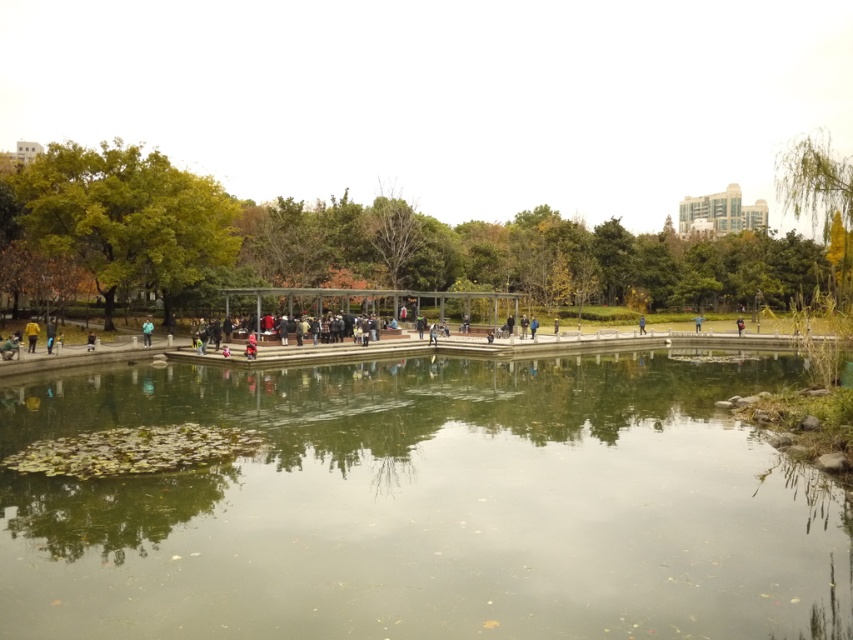
Question: Can you confirm if green reflective water at center is wider than yellow jacket at left?

Choices:
 (A) yes
 (B) no

Answer: (A)

Question: Estimate the real-world distances between objects in this image. Which object is closer to the yellow jacket at left?

Choices:
 (A) green reflective water at center
 (B) green fabric jacket at center

Answer: (B)

Question: Based on their relative distances, which object is farther from the green reflective water at center?

Choices:
 (A) green fabric jacket at center
 (B) yellow jacket at left

Answer: (A)

Question: Can you confirm if yellow jacket at left is positioned below green fabric jacket at center?

Choices:
 (A) yes
 (B) no

Answer: (A)

Question: Which object is closer to the camera taking this photo?

Choices:
 (A) green fabric jacket at center
 (B) yellow jacket at left
 (C) green reflective water at center

Answer: (C)

Question: Is green reflective water at center to the left of green fabric jacket at center from the viewer's perspective?

Choices:
 (A) no
 (B) yes

Answer: (A)